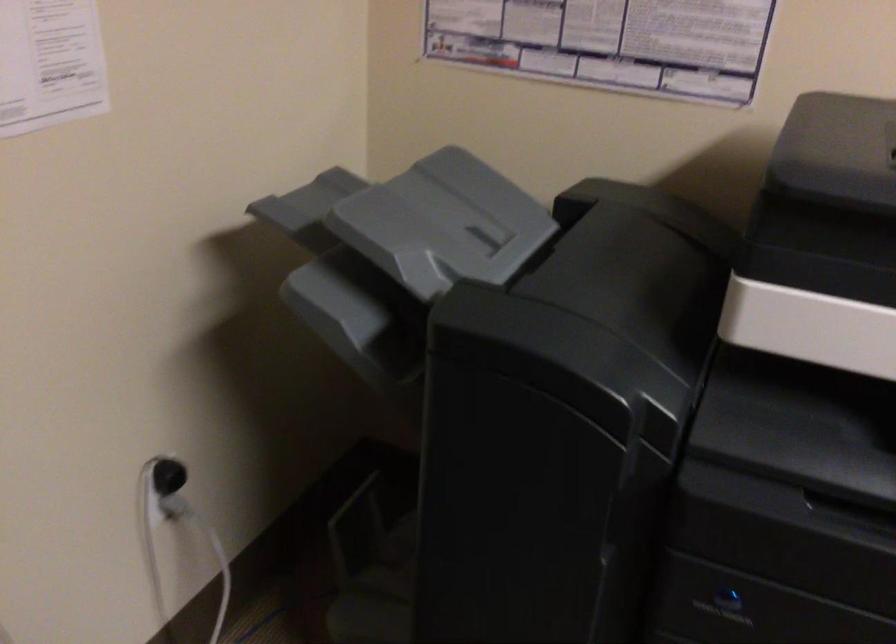
Describe the element at coordinates (823, 241) in the screenshot. I see `the printer scanner lid` at that location.